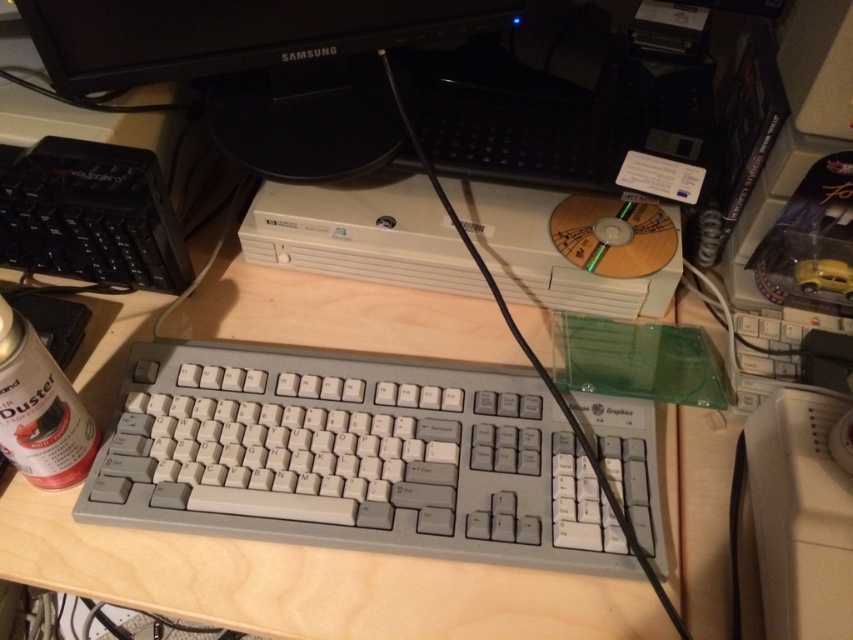
Is gray plastic keyboard at center below black glossy monitor at upper center?

Correct, gray plastic keyboard at center is located below black glossy monitor at upper center.

Is gray plastic keyboard at center behind black glossy monitor at upper center?

No.

Which is in front, point (309, 492) or point (376, 35)?

Positioned in front is point (309, 492).

This screenshot has width=853, height=640. I want to click on gray plastic keyboard at center, so (x=351, y=458).